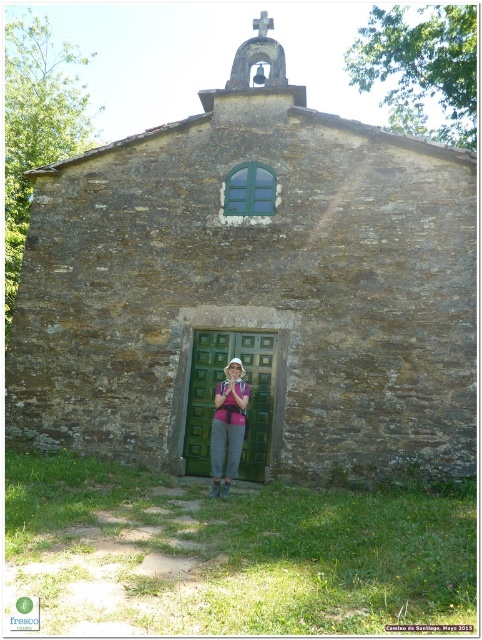
Between brown stone church at center and green matte door at center, which one appears on the right side from the viewer's perspective?

brown stone church at center

This screenshot has width=482, height=640. What are the coordinates of `brown stone church at center` in the screenshot? It's located at (253, 288).

The image size is (482, 640). What do you see at coordinates (253, 288) in the screenshot?
I see `brown stone church at center` at bounding box center [253, 288].

At what (x,y) coordinates should I click in order to perform the action: click on brown stone church at center. Please return your answer as a coordinate pair (x, y). Looking at the image, I should click on (253, 288).

Between point (201, 449) and point (239, 460), which one is positioned in front?

Point (239, 460) is in front.

Can you confirm if green matte door at center is thinner than pink fabric at center?

Yes.

Identify the location of green matte door at center. The image size is (482, 640). (215, 390).

I want to click on green matte door at center, so click(215, 390).

Does brown stone church at center have a lesser height compared to pink fabric at center?

No.

Consider the image. Is brown stone church at center above pink fabric at center?

Correct, brown stone church at center is located above pink fabric at center.

Where is `brown stone church at center`? The image size is (482, 640). brown stone church at center is located at coordinates (253, 288).